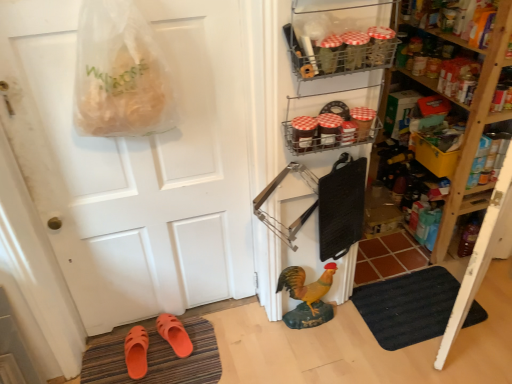
Where is `free spot to the left of orange rubber slippers at lower left, which is the second footwear from left to right`? This screenshot has width=512, height=384. free spot to the left of orange rubber slippers at lower left, which is the second footwear from left to right is located at coordinates (132, 335).